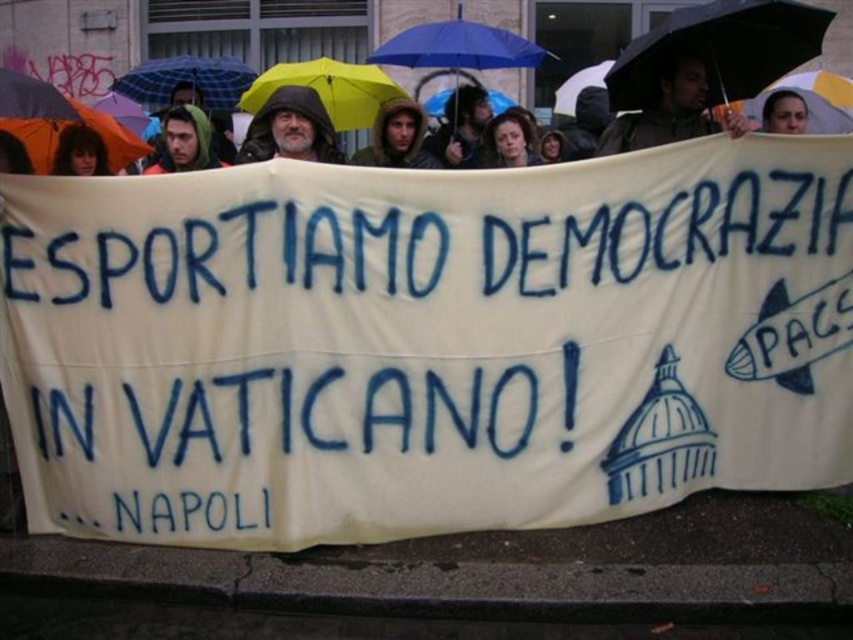
Question: Which is nearer to the blue matte umbrella at center?

Choices:
 (A) beige hooded jacket at center
 (B) white fabric banner at center
 (C) dark brown hair at center

Answer: (C)

Question: Can you confirm if black matte umbrella at upper center is positioned to the right of dark brown hair at center?

Choices:
 (A) yes
 (B) no

Answer: (A)

Question: Is dark brown leather jacket at upper center smaller than beige hooded jacket at center?

Choices:
 (A) no
 (B) yes

Answer: (A)

Question: Which point is closer to the camera taking this photo?

Choices:
 (A) (711, 220)
 (B) (419, 52)
 (C) (74, 124)
 (D) (172, 77)

Answer: (A)

Question: Is white fabric banner at center smaller than black matte umbrella at upper center?

Choices:
 (A) yes
 (B) no

Answer: (B)

Question: Which point appears closest to the camera in this image?

Choices:
 (A) (202, 132)
 (B) (305, 109)
 (C) (529, 56)
 (D) (659, 81)

Answer: (B)